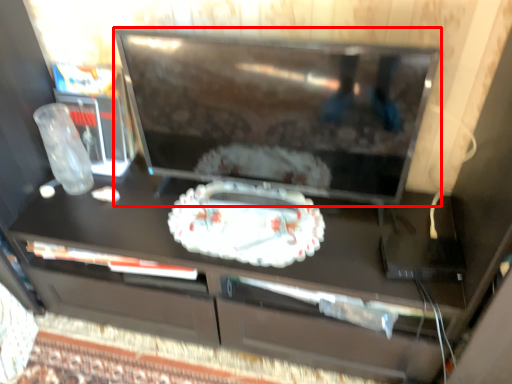
Question: Observing the image, what is the correct spatial positioning of television (annotated by the red box) in reference to cake?

Choices:
 (A) left
 (B) right

Answer: (B)